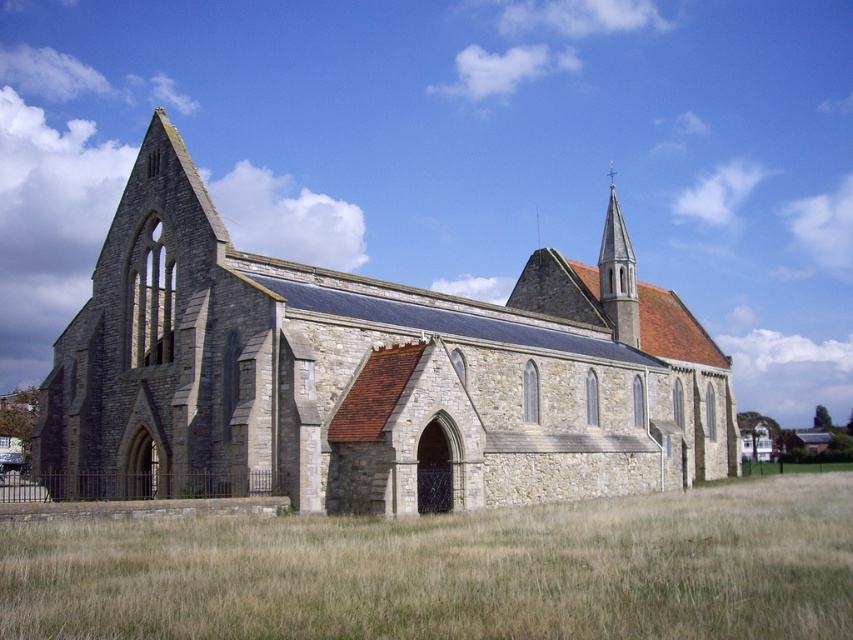
You are standing in front of the historic stone church and want to take a photo. You notice two points marked on the church facade at coordinates point (169,410) and point (624,232). Which point is closer to you, the photographer?

Point (169,410) is closer to the viewer than point (624,232), so the point at coordinates point (169,410) is closer to you.

You are standing in the field near the gray stone church at center. You want to take a photo of the church with your smartphone. Considering the distance, will you need to zoom out or zoom in to capture the entire church in one frame?

The gray stone church at center is 54.28 meters away from camera. Since the church is relatively far away, you will need to zoom out to capture the entire structure in one frame.

You are standing in front of the historic stone church and want to take a photo that includes both the brown dry grass at lower center and the smooth gold spire at upper center. Which object will appear larger in the photo?

The brown dry grass at lower center will appear larger in the photo because it is closer to the viewer than the smooth gold spire at upper center.